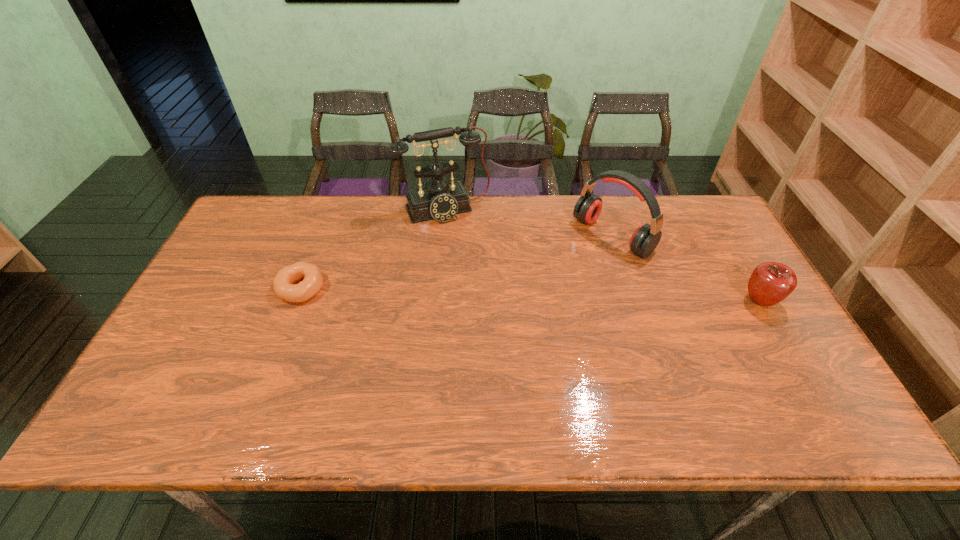
Where is `vacant space at the near edge of the desktop`? vacant space at the near edge of the desktop is located at coordinates (688, 380).

Where is `vacant point at the left edge`? vacant point at the left edge is located at coordinates (259, 279).

Where is `vacant space at the right edge of the desktop`? The height and width of the screenshot is (540, 960). vacant space at the right edge of the desktop is located at coordinates (747, 319).

Where is `free region at the far left corner`? The height and width of the screenshot is (540, 960). free region at the far left corner is located at coordinates (253, 218).

Identify the location of free space at the far right corner of the desktop. (725, 232).

The image size is (960, 540). I want to click on free spot between the earphone and the rightmost object, so pos(686,269).

Identify the location of free space between the doughnut and the third tallest object. (531, 295).

Locate an element on the screen. Image resolution: width=960 pixels, height=540 pixels. free space between the shortest object and the second tallest object is located at coordinates (457, 262).

Where is `free space between the leftmost object and the second object from left to right`? This screenshot has height=540, width=960. free space between the leftmost object and the second object from left to right is located at coordinates (373, 248).

Locate an element on the screen. vacant region between the third shortest object and the shortest object is located at coordinates (457, 262).